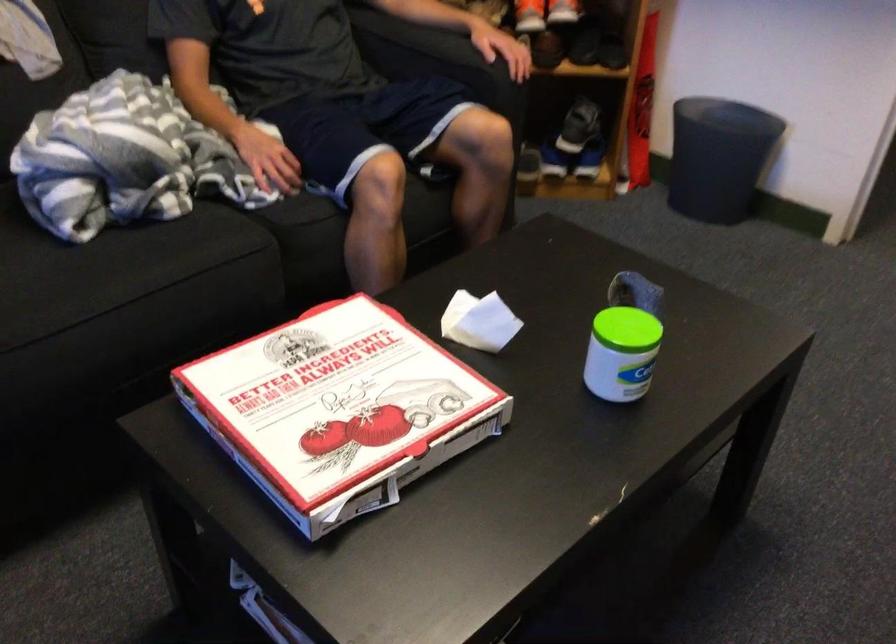
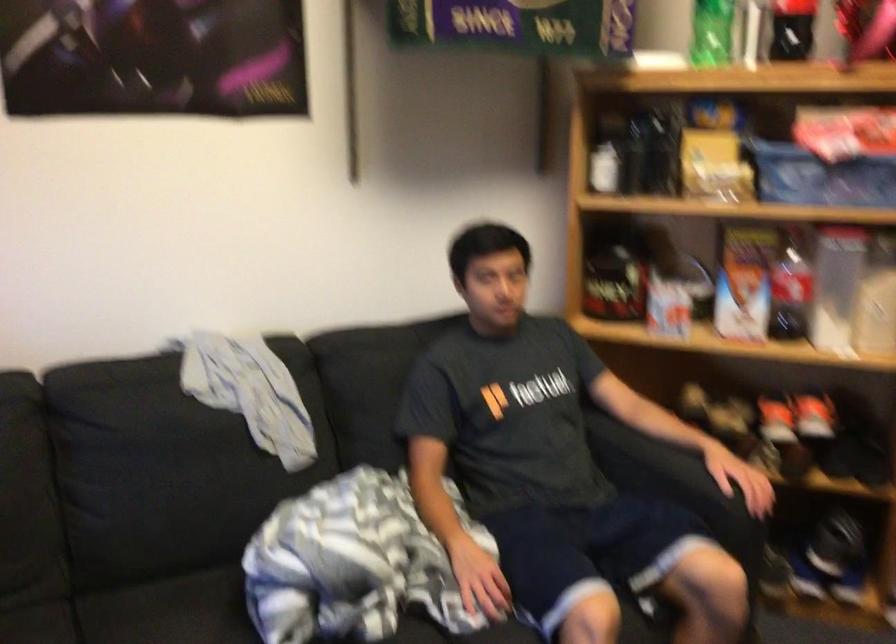
Question: Which direction would the cameraman need to move to produce the second image? Reply with the corresponding letter.

Choices:
 (A) Left
 (B) Right
 (C) Forward
 (D) Backward

Answer: (B)